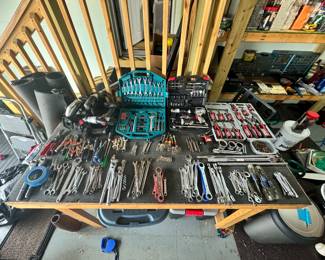
Locate an element on the screen. This screenshot has height=260, width=325. door is located at coordinates (132, 12).